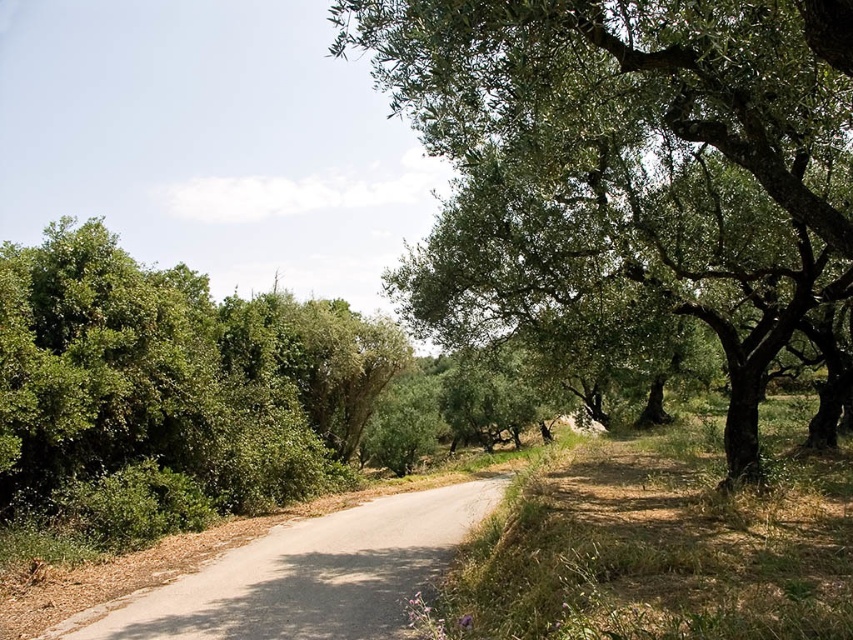
You are standing at the starting point of the road in the image. You want to place a small garden ornament exactly at the coordinates where the green leafy bush at left is currently located. What are the coordinates you should aim for?

The coordinates for the green leafy bush at left are at point (172, 381), so you should aim for those coordinates to place the garden ornament.

You are driving a car that is 2 meters wide. You come across a narrow section of the gray asphalt road at center. There is a green leafy bush at left nearby. Can your car safely pass through this section without hitting the bush?

The green leafy bush at left might be wider than the gray asphalt road at center. Since the road might be narrower than the car, there is a risk of collision with the bush. It is safer to avoid passing through this section.

You are a cyclist riding along the gray asphalt road at center. You need to make a sharp turn to the left to avoid hitting the green leafy tree at center. Which direction should you turn to avoid it?

The green leafy tree at center is positioned on the right side of gray asphalt road at center, so you should turn to the left to avoid it.